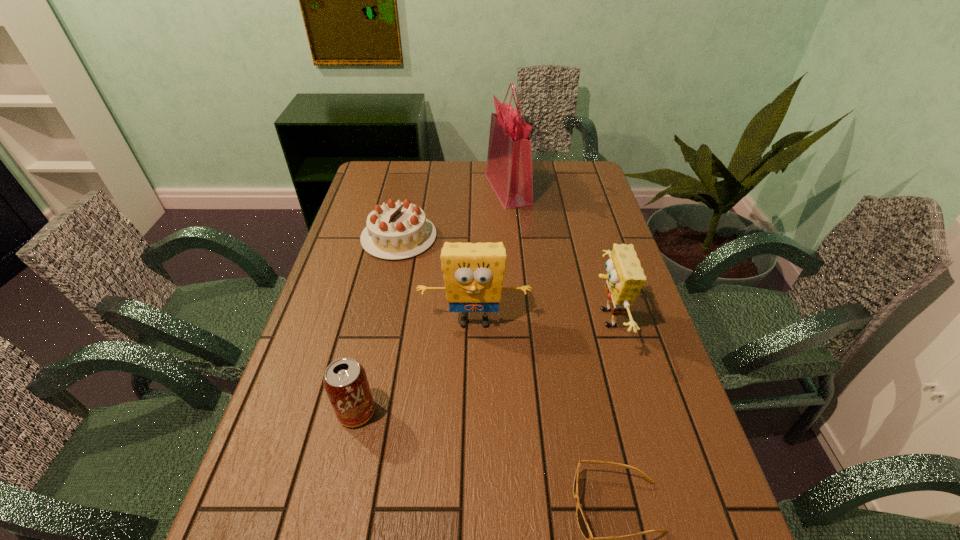
This screenshot has height=540, width=960. I want to click on the tallest object, so click(509, 170).

The width and height of the screenshot is (960, 540). In order to click on the farthest object in this screenshot , I will do `click(509, 170)`.

Where is `the left sponge`? the left sponge is located at coordinates (473, 273).

Locate an element on the screen. The height and width of the screenshot is (540, 960). the right sponge is located at coordinates (625, 278).

The image size is (960, 540). What are the coordinates of `the fifth farthest object` in the screenshot? It's located at (345, 381).

I want to click on the fourth tallest object, so click(x=345, y=381).

I want to click on birthday cake, so click(x=397, y=230).

Identify the location of the second shortest object. pyautogui.click(x=397, y=230).

Find the location of a particular element. The image size is (960, 540). free point located on the left of the farthest object is located at coordinates click(x=468, y=189).

Identify the location of free space located on the face of the left sponge. (474, 371).